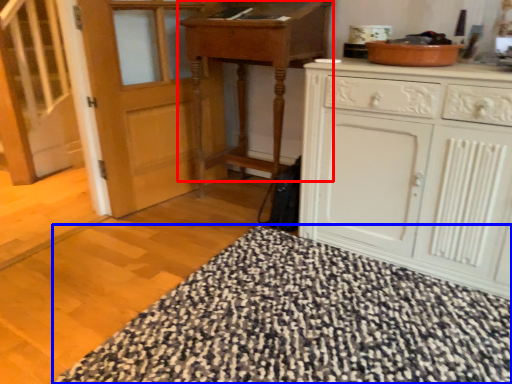
Question: Which of the following is the closest to the observer, table (highlighted by a red box) or blanket (highlighted by a blue box)?

Choices:
 (A) table
 (B) blanket

Answer: (B)